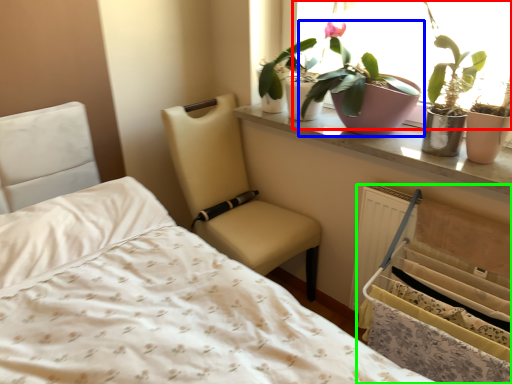
Question: Which object is the closest to the window (highlighted by a red box)? Choose among these: houseplant (highlighted by a blue box) or bed frame (highlighted by a green box).

Choices:
 (A) houseplant
 (B) bed frame

Answer: (A)